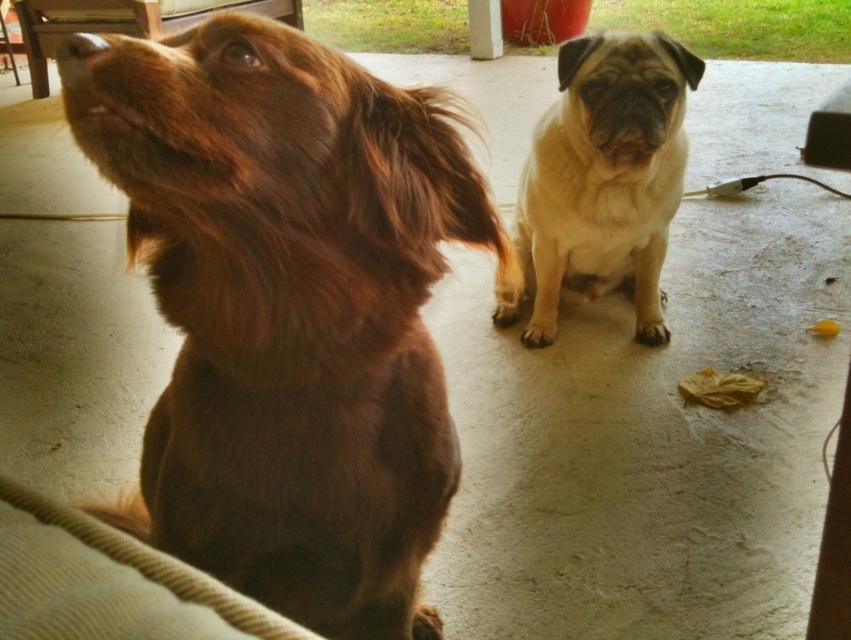
Question: Can you confirm if brown furry dog at left is positioned to the left of beige fur dog at center?

Choices:
 (A) yes
 (B) no

Answer: (A)

Question: Which object appears closest to the camera in this image?

Choices:
 (A) beige fur dog at center
 (B) brown furry dog at left

Answer: (B)

Question: Is brown furry dog at left positioned behind beige fur dog at center?

Choices:
 (A) yes
 (B) no

Answer: (B)

Question: Is brown furry dog at left in front of beige fur dog at center?

Choices:
 (A) no
 (B) yes

Answer: (B)

Question: Among these points, which one is nearest to the camera?

Choices:
 (A) (197, 244)
 (B) (585, 193)

Answer: (A)